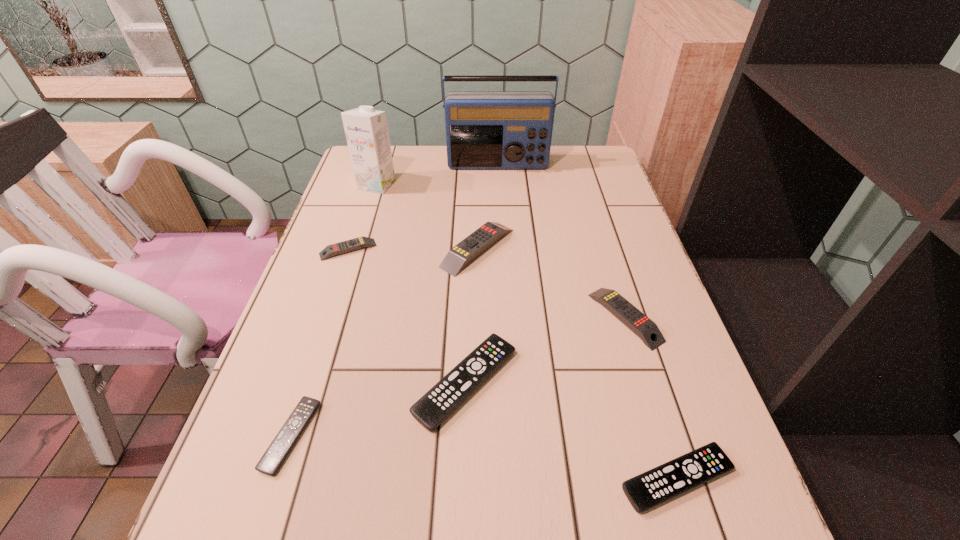
Where is `free space that is in between the radio receiver and the seventh nearest object`? Image resolution: width=960 pixels, height=540 pixels. free space that is in between the radio receiver and the seventh nearest object is located at coordinates (437, 175).

Select which object appears as the seventh closest to the biggest black remote control. Please provide its 2D coordinates. Your answer should be formatted as a tuple, i.e. [(x, y)], where the tuple contains the x and y coordinates of a point satisfying the conditions above.

[(484, 129)]

Select which object appears as the seventh closest to the radio receiver. Please provide its 2D coordinates. Your answer should be formatted as a tuple, i.e. [(x, y)], where the tuple contains the x and y coordinates of a point satisfying the conditions above.

[(662, 483)]

Identify the location of the second closest remote control relative to the third tallest object. The height and width of the screenshot is (540, 960). (331, 250).

Where is `remote control that is the fourth closest to the second yellow remote control from left to right`? This screenshot has width=960, height=540. remote control that is the fourth closest to the second yellow remote control from left to right is located at coordinates (272, 459).

You are a GUI agent. You are given a task and a screenshot of the screen. Output one action in this format:
    pyautogui.click(x=<x>, y=<y>)
    Task: Click on the yellow remote control identified as the closest to the second yellow remote control from left to right
    
    Given the screenshot: What is the action you would take?
    pyautogui.click(x=639, y=323)

Locate which yellow remote control is the closest to the smallest yellow remote control. Please provide its 2D coordinates. Your answer should be formatted as a tuple, i.e. [(x, y)], where the tuple contains the x and y coordinates of a point satisfying the conditions above.

[(460, 255)]

Locate an element on the screen. black remote control object that ranks as the third closest to the second smallest yellow remote control is located at coordinates (272, 459).

Locate an element on the screen. The width and height of the screenshot is (960, 540). black remote control that stands as the closest to the leftmost yellow remote control is located at coordinates (453, 389).

Identify the location of vacant point that satisfies the following two spatial constraints: 1. on the front panel of the radio receiver; 2. on the right side of the nearest yellow remote control. The image size is (960, 540). (506, 318).